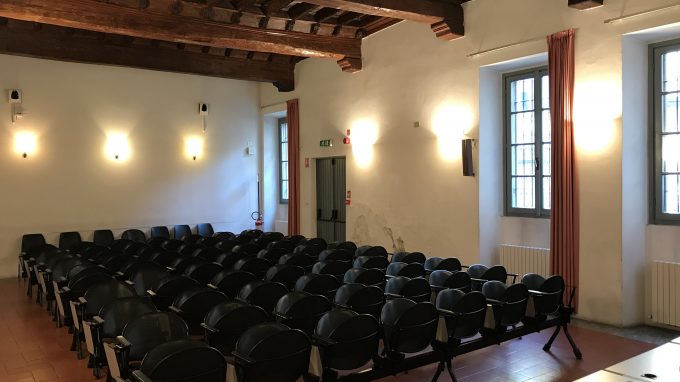
The height and width of the screenshot is (382, 680). I want to click on door, so click(x=330, y=201).